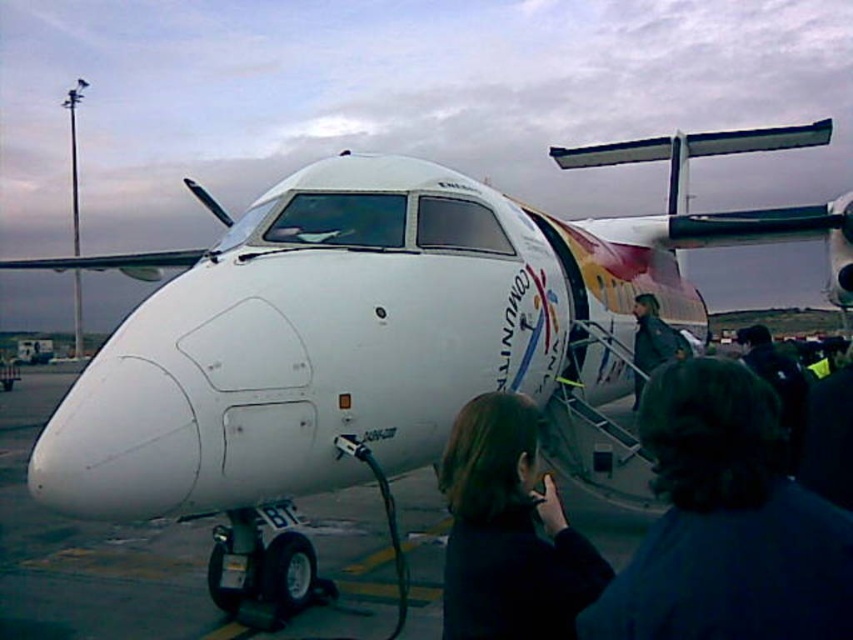
Question: Based on their relative distances, which object is farther from the black matte jacket at lower center?

Choices:
 (A) dark brown hair at lower center
 (B) dark blue jacket at center

Answer: (B)

Question: Does dark brown hair at lower center appear over dark blue jacket at center?

Choices:
 (A) yes
 (B) no

Answer: (A)

Question: Which object is the farthest from the black matte jacket at lower center?

Choices:
 (A) dark blue jacket at center
 (B) dark brown hair at lower center

Answer: (A)

Question: Estimate the real-world distances between objects in this image. Which object is farther from the dark blue jacket at center?

Choices:
 (A) dark brown hair at lower center
 (B) black matte jacket at lower center

Answer: (A)

Question: Can you confirm if dark brown hair at lower center is positioned to the right of dark blue jacket at center?

Choices:
 (A) yes
 (B) no

Answer: (B)

Question: Can you confirm if black matte jacket at lower center is positioned below dark blue jacket at center?

Choices:
 (A) no
 (B) yes

Answer: (B)